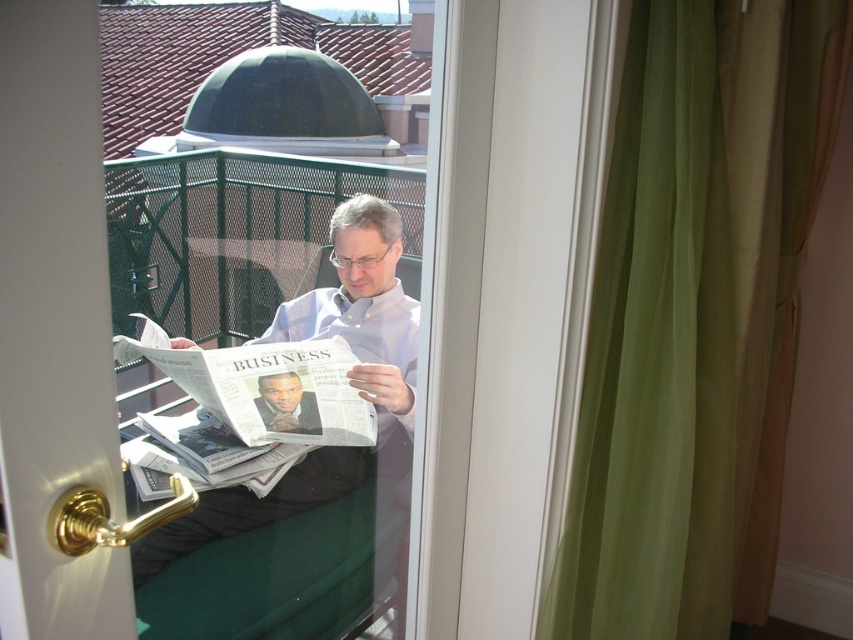
Question: Does white glossy door at center appear under light gray shirt at center?

Choices:
 (A) no
 (B) yes

Answer: (A)

Question: Which point is closer to the camera?

Choices:
 (A) (22, 81)
 (B) (286, 508)
 (C) (316, 416)
 (D) (699, 371)

Answer: (A)

Question: Which point is farther from the camera taking this photo?

Choices:
 (A) (80, 212)
 (B) (675, 220)
 (C) (338, 449)
 (D) (294, 422)

Answer: (C)

Question: Considering the relative positions of green fabric curtain at right and white glossy door at center in the image provided, where is green fabric curtain at right located with respect to white glossy door at center?

Choices:
 (A) above
 (B) below

Answer: (B)

Question: Can you confirm if green fabric curtain at right is smaller than matte black newspaper at center?

Choices:
 (A) yes
 (B) no

Answer: (B)

Question: Which of the following is the farthest from the observer?

Choices:
 (A) (270, 381)
 (B) (13, 554)
 (C) (260, 516)
 (D) (659, 461)

Answer: (A)